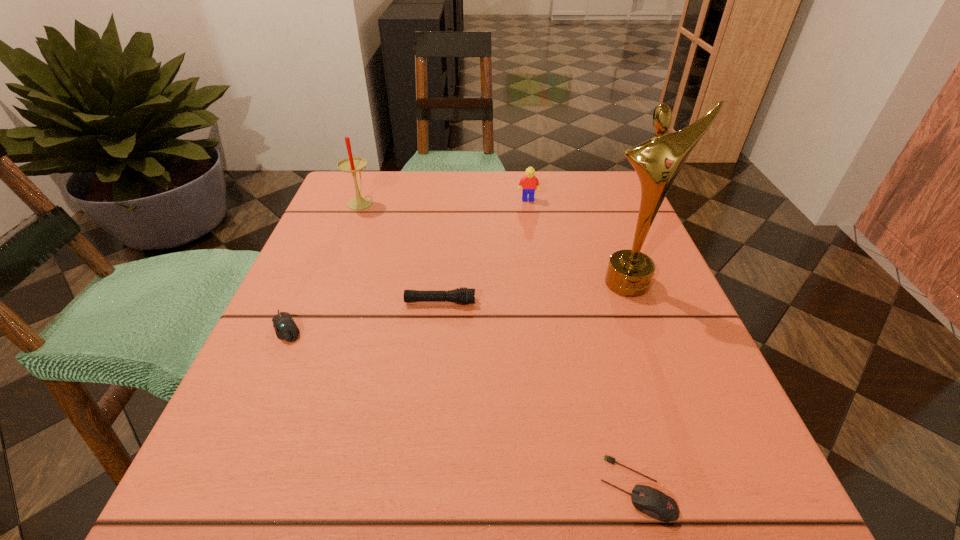
At what (x,y) coordinates should I click in order to perform the action: click on free location at the near left corner of the desktop. Please return your answer as a coordinate pair (x, y). Looking at the image, I should click on (187, 498).

In the image, there is a desktop. Find the location of `free space at the far right corner`. free space at the far right corner is located at coordinates (592, 175).

This screenshot has height=540, width=960. What are the coordinates of `empty space between the farther mouse and the flashlight` in the screenshot? It's located at (364, 315).

Locate an element on the screen. Image resolution: width=960 pixels, height=540 pixels. vacant area between the right mouse and the fourth tallest object is located at coordinates (538, 395).

You are a GUI agent. You are given a task and a screenshot of the screen. Output one action in this format:
    pyautogui.click(x=<x>, y=<y>)
    Task: Click on the empty space between the award and the nearest object
    Image resolution: width=960 pixels, height=540 pixels.
    Given the screenshot: What is the action you would take?
    pyautogui.click(x=632, y=386)

The width and height of the screenshot is (960, 540). Find the location of `vacant area between the farther mouse and the candle`. vacant area between the farther mouse and the candle is located at coordinates (324, 265).

Image resolution: width=960 pixels, height=540 pixels. Identify the location of vacant area that lies between the right mouse and the award. (632, 386).

This screenshot has width=960, height=540. I want to click on free space between the third object from left to right and the nearest object, so click(538, 395).

What are the coordinates of `free space between the fifth shortest object and the left mouse` in the screenshot? It's located at (324, 265).

At what (x,y) coordinates should I click in order to perform the action: click on free space between the flashlight and the nearest object. Please return your answer as a coordinate pair (x, y). Looking at the image, I should click on (538, 395).